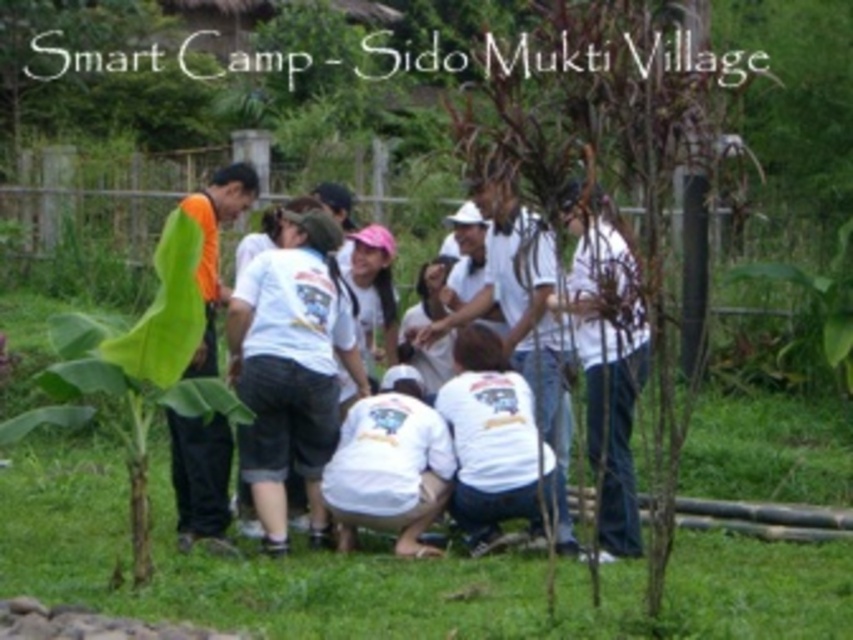
Is point (303, 349) positioned after point (155, 372)?

That is True.

Can you confirm if white cotton shirt at center is shorter than green leafy banana tree at left?

No, white cotton shirt at center is not shorter than green leafy banana tree at left.

This screenshot has height=640, width=853. What are the coordinates of `white cotton shirt at center` in the screenshot? It's located at (291, 369).

The image size is (853, 640). In order to click on white cotton shirt at center in this screenshot , I will do tap(291, 369).

Between point (334, 378) and point (195, 532), which one is positioned behind?

Positioned behind is point (195, 532).

Which is above, white cotton shirt at center or orange fabric shirt at left?

orange fabric shirt at left is above.

Who is more distant from viewer, (276, 342) or (206, 211)?

Point (206, 211)

You are a GUI agent. You are given a task and a screenshot of the screen. Output one action in this format:
    pyautogui.click(x=<x>, y=<y>)
    Task: Click on the white cotton shirt at center
    
    Given the screenshot: What is the action you would take?
    pyautogui.click(x=291, y=369)

Is point (59, 336) positioned before point (224, 296)?

That is True.

Which is in front, point (71, 340) or point (218, 289)?

Point (71, 340) is more forward.

The image size is (853, 640). I want to click on green leafy banana tree at left, so click(x=144, y=364).